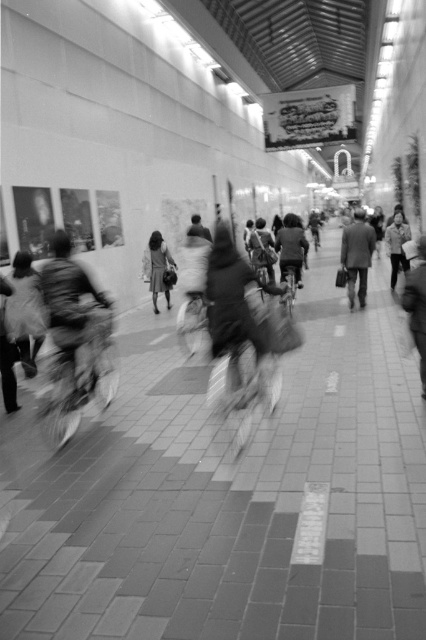
In the scene shown: You are a person with a height of 1.7 meters standing in the corridor and see the smooth fabric bag at left. Can you pick it up without moving your feet?

The smooth fabric bag at left is 6.21 meters away from viewer. Since the distance is greater than the person height of 1.7 meters, the person cannot reach it without moving their feet.

You are a security guard in the mall and need to monitor both the dark gray suit at center and the matte black bicycle at center. Which object is bigger in size?

The dark gray suit at center has a larger size compared to the matte black bicycle at center, so the dark gray suit at center is bigger in size.

Consider the image. You are a person walking down the corridor and want to pick up both the smooth fabric bag at left and the dark gray suit at center. Which object should you approach first to reach them in the correct order?

You should approach the smooth fabric bag at left first since it is located to the left of the dark gray suit at center, meaning it is closer to your current position if you are walking along the corridor from left to right.